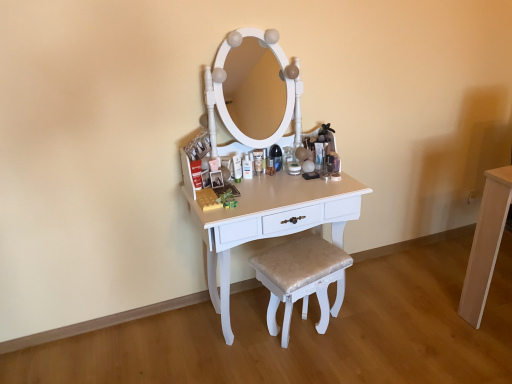
Find the location of `vacant space that is to the left of light wood cabinet at right, the 2th table when ordered from left to right`. vacant space that is to the left of light wood cabinet at right, the 2th table when ordered from left to right is located at coordinates (457, 296).